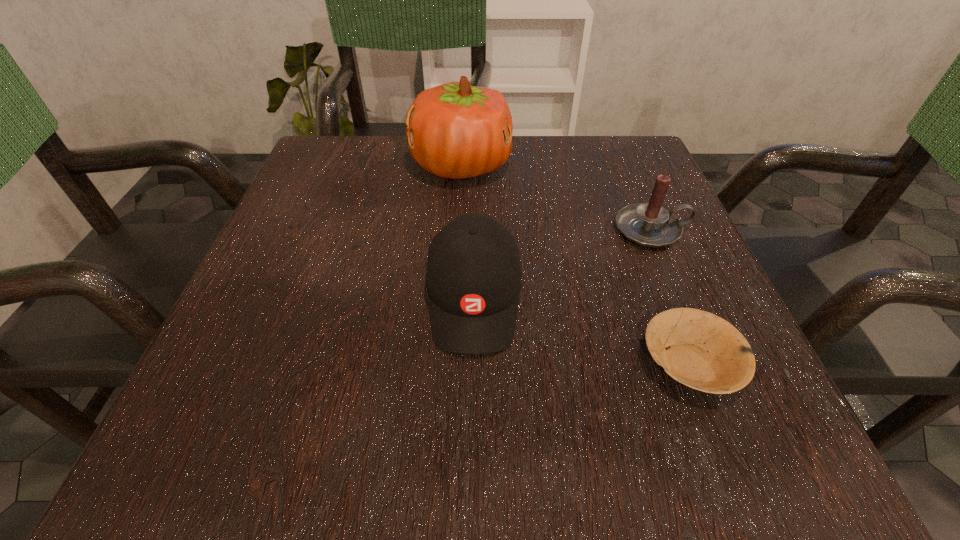
At what (x,y) coordinates should I click in order to perform the action: click on pumpkin. Please return your answer as a coordinate pair (x, y). The height and width of the screenshot is (540, 960). Looking at the image, I should click on (454, 130).

Find the location of `the tallest object`. the tallest object is located at coordinates (454, 130).

This screenshot has width=960, height=540. Identify the location of candle. (649, 224).

Locate an element on the screen. baseball cap is located at coordinates (473, 277).

Where is `the shortest object`? the shortest object is located at coordinates (703, 351).

At what (x,y) coordinates should I click in order to perform the action: click on free space located 0.290m on the side of the tallest object with the cute face. Please return your answer as a coordinate pair (x, y). This screenshot has width=960, height=540. Looking at the image, I should click on (644, 165).

Locate an element on the screen. This screenshot has height=540, width=960. vacant region located 0.070m with a logo on the front of the baseball cap is located at coordinates (472, 406).

I want to click on free point located on the left of the bowl, so click(x=510, y=364).

Identify the location of object present at the far edge. (454, 130).

This screenshot has height=540, width=960. I want to click on object situated at the near edge, so click(x=703, y=351).